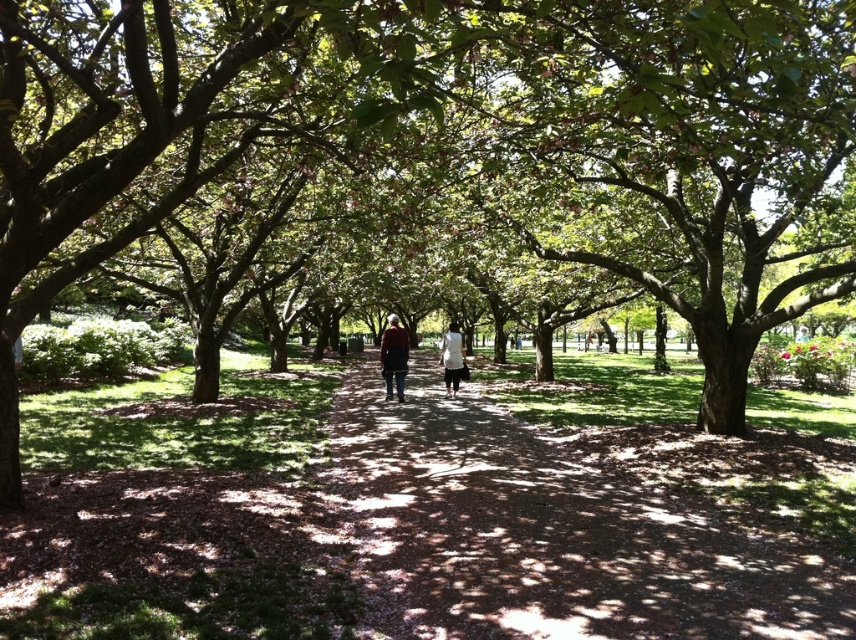
Question: Can you confirm if matte black jacket at center is positioned to the left of white matte dress at center?

Choices:
 (A) yes
 (B) no

Answer: (A)

Question: Which of the following is the farthest from the observer?

Choices:
 (A) (450, 381)
 (B) (389, 344)
 (C) (571, 588)

Answer: (A)

Question: Can you confirm if brown dirt path at center is bigger than white matte dress at center?

Choices:
 (A) yes
 (B) no

Answer: (A)

Question: Is matte black jacket at center to the left of white matte dress at center from the viewer's perspective?

Choices:
 (A) no
 (B) yes

Answer: (B)

Question: Among these points, which one is farthest from the camera?

Choices:
 (A) [x=390, y=333]
 (B) [x=372, y=579]

Answer: (A)

Question: Which object appears closest to the camera in this image?

Choices:
 (A) brown dirt path at center
 (B) white matte dress at center

Answer: (A)